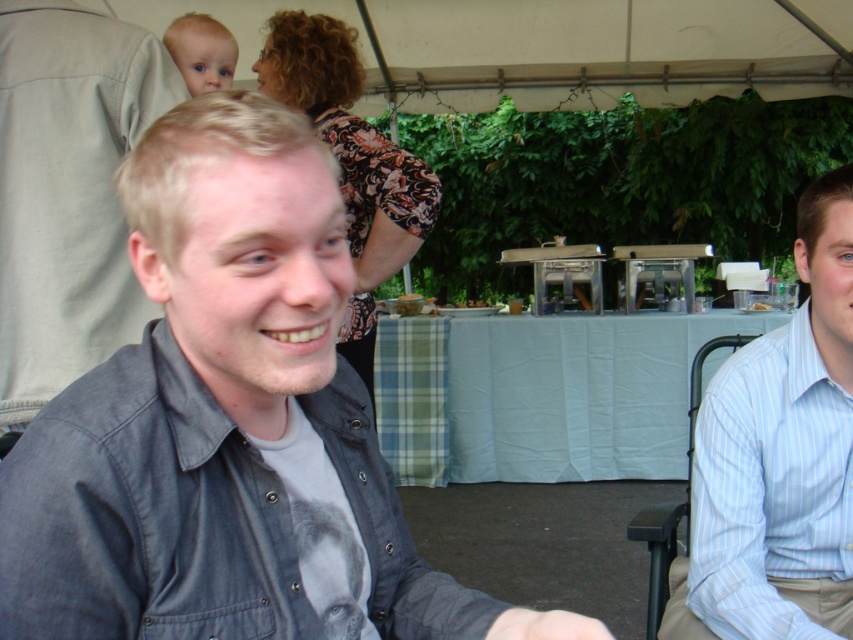
You are organizing a small event and need to arrange items on a table. You have a denim jacket at left and a green plaid fabric at center. Which item takes up more space on the table?

The green plaid fabric at center takes up more space than the denim jacket at left because the denim jacket at left occupies less space than green plaid fabric at center.

In the scene shown: You are a photographer at the event and want to capture a photo of both the denim shirt at center and the light blue striped shirt at right clearly. Since the camera can only focus on one subject at a time, which subject should you focus on to ensure the other is still somewhat in focus?

You should focus on the denim shirt at center because it is in front of the light blue striped shirt at right, so focusing on the closer subject will keep the background subject somewhat in focus.

You are at a social gathering under a tent and see two people sitting side by side. The person on the left is wearing a denim jacket at left, and the person on the right is wearing a light blue striped shirt at right. Which one is sitting lower in position?

The light blue striped shirt at right is located below denim jacket at left, so the person wearing the light blue striped shirt at right is sitting lower in position.